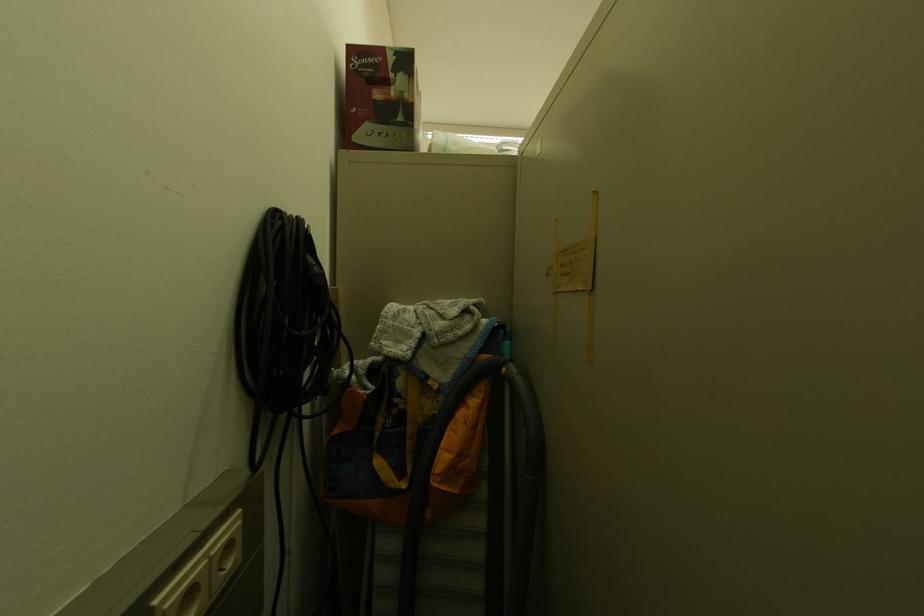
What do you see at coordinates (480, 483) in the screenshot?
I see `the vacuum cleaner hose` at bounding box center [480, 483].